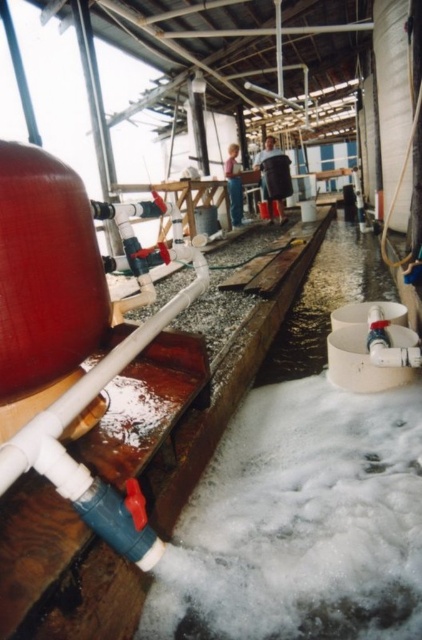
Question: Is white matte pipe at center-left to the left of metallic pipe at center from the viewer's perspective?

Choices:
 (A) yes
 (B) no

Answer: (A)

Question: From the image, what is the correct spatial relationship of foamy white water at center in relation to dark gray fabric pants at center?

Choices:
 (A) left
 (B) right

Answer: (A)

Question: Which point is closer to the camera?

Choices:
 (A) dark gray fabric pants at center
 (B) white matte pipe at center-left

Answer: (B)

Question: Which object is the closest to the white matte pipe at center-left?

Choices:
 (A) blue shirt at center
 (B) dark gray fabric pants at center
 (C) foamy white water at center
 (D) metallic pipe at center

Answer: (C)

Question: Does dark gray fabric pants at center have a smaller size compared to metallic pipe at center?

Choices:
 (A) yes
 (B) no

Answer: (A)

Question: Among these objects, which one is nearest to the camera?

Choices:
 (A) blue shirt at center
 (B) metallic pipe at center

Answer: (B)